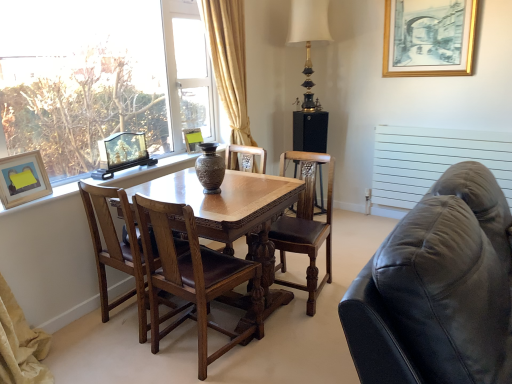
Question: Is brown leather chair at center, which appears as the first chair when viewed from the left, taller than black matte speaker at center?

Choices:
 (A) yes
 (B) no

Answer: (B)

Question: Is brown leather chair at center, which appears as the first chair when viewed from the left, smaller than black matte speaker at center?

Choices:
 (A) no
 (B) yes

Answer: (A)

Question: From a real-world perspective, is brown leather chair at center, which ranks as the 3th chair in right-to-left order, located beneath black matte speaker at center?

Choices:
 (A) yes
 (B) no

Answer: (A)

Question: Does brown leather chair at center, which appears as the first chair when viewed from the left, have a greater width compared to black matte speaker at center?

Choices:
 (A) no
 (B) yes

Answer: (B)

Question: Is the position of brown leather chair at center, which ranks as the 3th chair in right-to-left order, less distant than that of black matte speaker at center?

Choices:
 (A) yes
 (B) no

Answer: (A)

Question: Considering the relative positions of black matte speaker at center and gold-bronze table lamp at upper center in the image provided, is black matte speaker at center to the left or to the right of gold-bronze table lamp at upper center?

Choices:
 (A) right
 (B) left

Answer: (A)

Question: Considering the positions of black matte speaker at center and gold-bronze table lamp at upper center in the image, is black matte speaker at center bigger or smaller than gold-bronze table lamp at upper center?

Choices:
 (A) small
 (B) big

Answer: (A)

Question: From the image's perspective, relative to gold-bronze table lamp at upper center, is black matte speaker at center above or below?

Choices:
 (A) below
 (B) above

Answer: (A)

Question: Considering the positions of point (306, 140) and point (306, 41), is point (306, 140) closer or farther from the camera than point (306, 41)?

Choices:
 (A) closer
 (B) farther

Answer: (B)

Question: Relative to black matte speaker at center, is matte black picture frame at center, marked as the third picture frame in a left-to-right arrangement, in front or behind?

Choices:
 (A) behind
 (B) front

Answer: (B)

Question: Visually, is matte black picture frame at center, marked as the third picture frame in a left-to-right arrangement, positioned to the left or to the right of black matte speaker at center?

Choices:
 (A) right
 (B) left

Answer: (B)

Question: From the image's perspective, is matte black picture frame at center, marked as the third picture frame in a left-to-right arrangement, positioned above or below black matte speaker at center?

Choices:
 (A) above
 (B) below

Answer: (A)

Question: Is point 196,142 closer or farther from the camera than point 315,150?

Choices:
 (A) closer
 (B) farther

Answer: (A)

Question: Visually, is wooden picture frame at upper left, which is the first picture frame from left to right, positioned to the left or to the right of matte black picture frame at center, the 2th picture frame when ordered from right to left?

Choices:
 (A) left
 (B) right

Answer: (A)

Question: Is point (40, 165) positioned closer to the camera than point (195, 148)?

Choices:
 (A) closer
 (B) farther

Answer: (A)